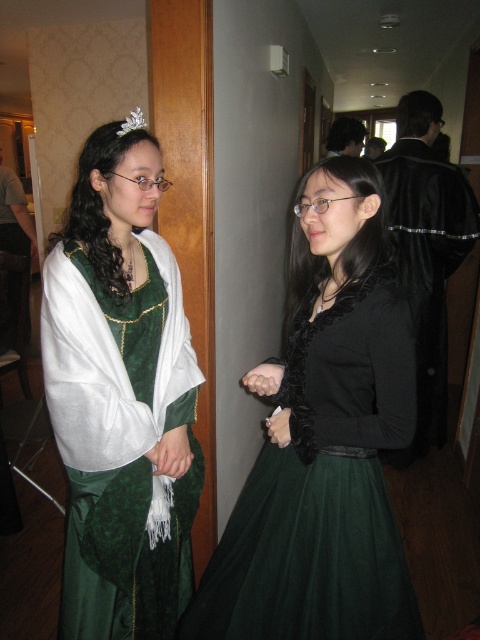
You are an artist sketching the scene and need to determine the placement of hands in your drawing. Which object is located to the left of the other between the smooth skin hand at center and the matte black glove at center?

The smooth skin hand at center is positioned on the left side of the matte black glove at center.

You are designing a display case for a museum exhibit featuring the matte black blouse at center and the silver metallic tiara at upper left. The case has a height limit of 30 cm. Given their sizes, can both items fit vertically without overlapping?

The matte black blouse at center has a greater height compared to the silver metallic tiara at upper left. However, without specific measurements, it is impossible to determine if both items can fit within the 30 cm height limit. Additional information about their exact heights is required to ensure proper placement.